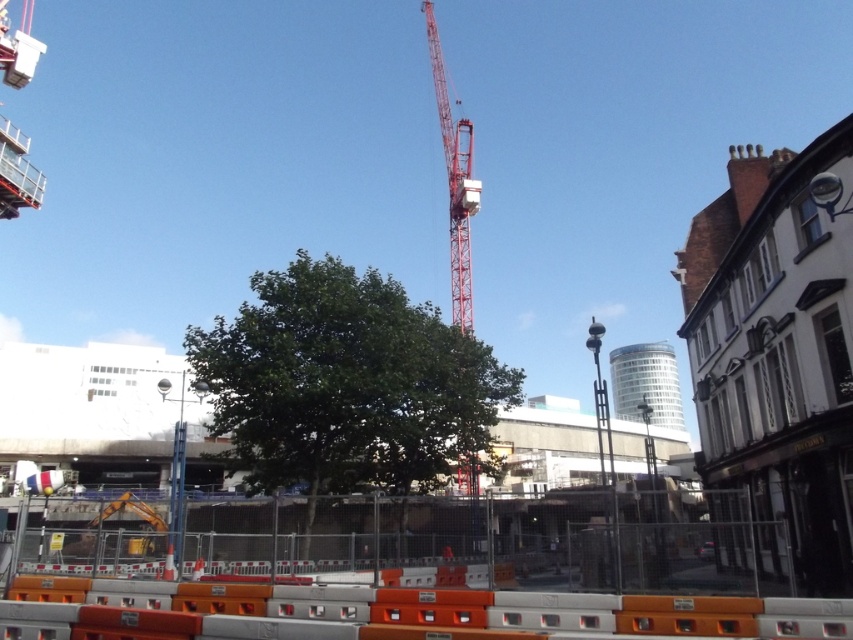
You are a delivery person needing to pass through the construction site to reach the delivery zone. The path between the green leafy tree at center and the red metallic crane at center is your only route. Can you safely navigate through this path if your delivery truck is 3 meters wide?

The path between the green leafy tree at center and the red metallic crane at center is 10.78 meters wide. Since the truck is only 3 meters wide, there is sufficient space for the truck to pass through safely.

You are a delivery driver who needs to enter the construction site. The site manager tells you that you can only pass through if the green leafy tree at center is not blocking your path to the red metallic crane at center. Can you proceed?

The green leafy tree at center is in front of the red metallic crane at center, so it is blocking the path. Therefore, you cannot proceed.